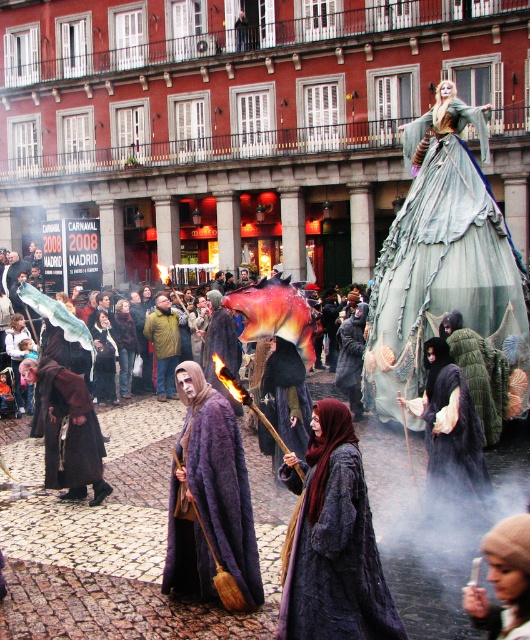
Based on the photo, you are a photographer at the carnival and want to capture both the brown woolen robe at center and the fuzzy dark cloak at center in a single frame. Which object should you focus on first to ensure both are in the shot?

The brown woolen robe at center is bigger than the fuzzy dark cloak at center, so you should focus on the brown woolen robe at center first to ensure both are in the shot.

You are standing at the center of the plaza and see the green sheer dress at upper right and a camera. Which object is closer to you?

The green sheer dress at upper right is closer to you because it is only 39.45 meters away from the camera, but since you are at the center, the distance between you and the camera isn

You are a photographer trying to capture both the black velvet robe at center and the fuzzy dark cloak at center in a single frame. Which of the two should you focus on first to ensure both are in the shot?

You should focus on the fuzzy dark cloak at center first because it is larger than the black velvet robe at center, allowing you to frame it properly before adjusting for the smaller robe.